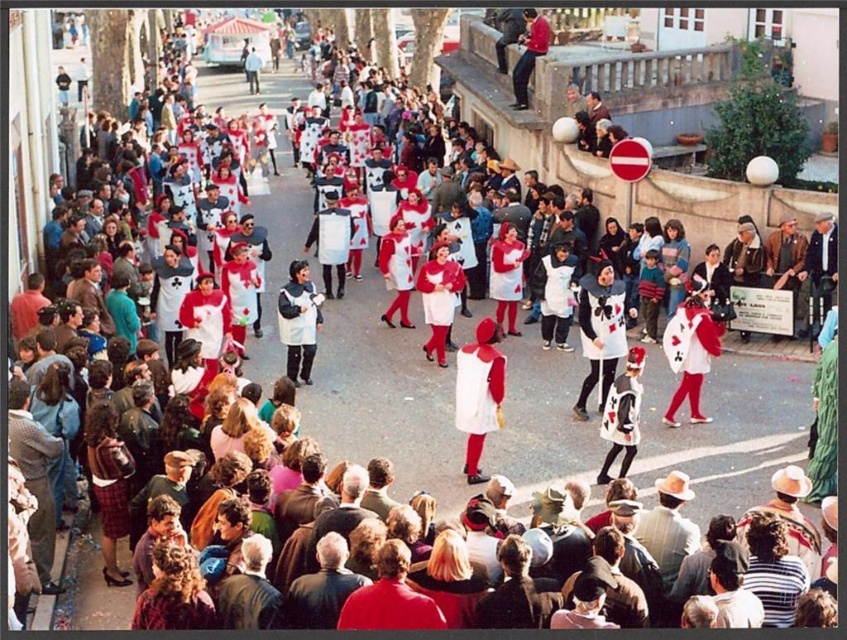
Between point (164, 588) and point (436, 560), which one is positioned behind?

The point (436, 560) is behind.

Does matte red coat at lower left have a lesser width compared to blonde hair at center?

No.

The height and width of the screenshot is (640, 847). Identify the location of matte red coat at lower left. (173, 593).

Find the location of a particular element. matte red coat at lower left is located at coordinates (173, 593).

Does blonde hair at center have a smaller size compared to denim jacket at lower left?

Yes, blonde hair at center is smaller than denim jacket at lower left.

Can you confirm if blonde hair at center is thinner than denim jacket at lower left?

No.

Describe the element at coordinates (450, 579) in the screenshot. The height and width of the screenshot is (640, 847). I see `blonde hair at center` at that location.

Locate an element on the screen. blonde hair at center is located at coordinates (450, 579).

Based on the photo, which is more to the right, plaid skirt at lower left or denim jacket at lower left?

From the viewer's perspective, plaid skirt at lower left appears more on the right side.

Which of these two, plaid skirt at lower left or denim jacket at lower left, stands shorter?

With less height is denim jacket at lower left.

Describe the element at coordinates (108, 484) in the screenshot. I see `plaid skirt at lower left` at that location.

Locate an element on the screen. Image resolution: width=847 pixels, height=640 pixels. plaid skirt at lower left is located at coordinates (108, 484).